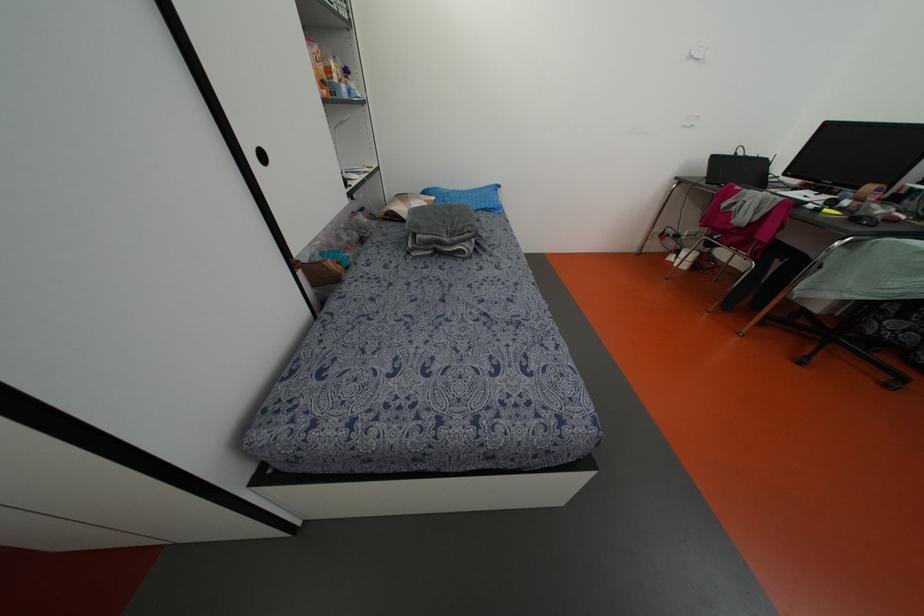
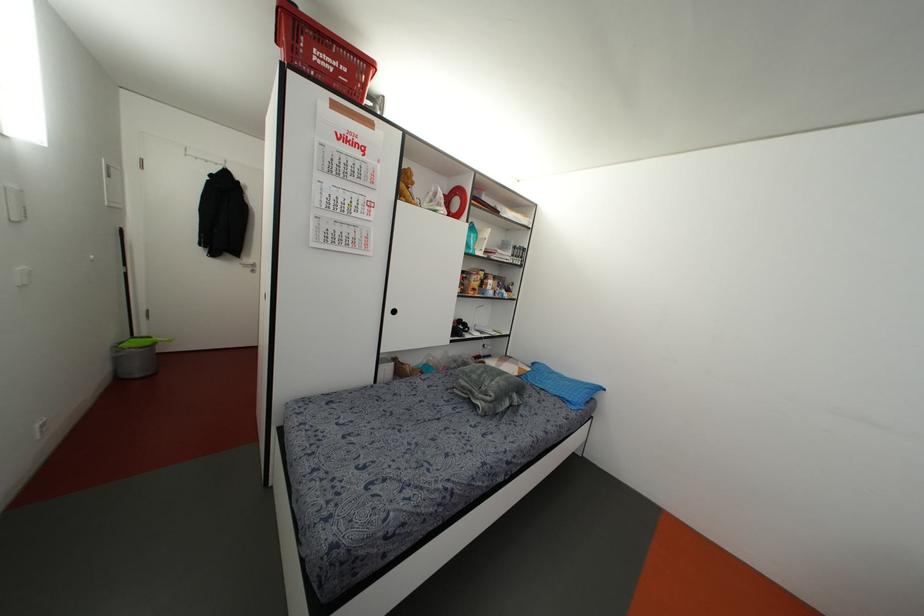
Based on the photo, the images are taken continuously from a first-person perspective. In which direction is your viewpoint rotating?

The rotation direction of the camera is left-up.